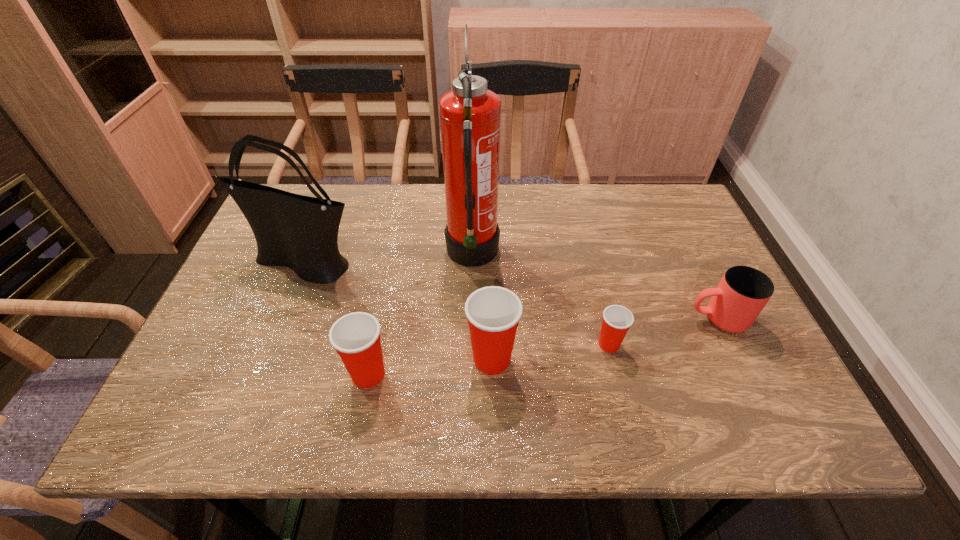
Identify the location of object that is positioned at the right edge. click(x=743, y=292).

In the image, there is a desktop. At what (x,y) coordinates should I click in order to perform the action: click on blank space at the far edge. Please return your answer as a coordinate pair (x, y). The height and width of the screenshot is (540, 960). Looking at the image, I should click on [x=441, y=199].

Find the location of a particular element. The width and height of the screenshot is (960, 540). vacant space at the near edge of the desktop is located at coordinates (657, 380).

The height and width of the screenshot is (540, 960). In order to click on free space at the left edge of the desktop in this screenshot , I will do `click(237, 301)`.

In the image, there is a desktop. Identify the location of vacant space at the right edge. (699, 336).

Image resolution: width=960 pixels, height=540 pixels. Find the location of `vacant region at the far right corner`. vacant region at the far right corner is located at coordinates (674, 200).

This screenshot has width=960, height=540. In order to click on free space that is in between the second shortest object and the second object from right to left in this screenshot , I will do `click(663, 332)`.

I want to click on unoccupied position between the rightmost object and the rightmost Dixie cup, so click(663, 332).

Locate an element on the screen. The image size is (960, 540). vacant area between the shortest object and the second Dixie cup from left to right is located at coordinates (550, 352).

The width and height of the screenshot is (960, 540). In order to click on vacant space that's between the cup and the leftmost Dixie cup in this screenshot , I will do pos(543,346).